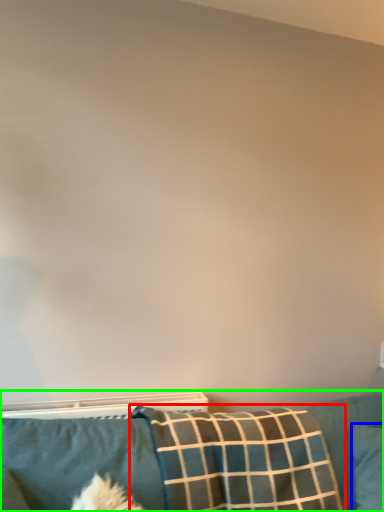
Question: Which is nearer to the pillow (highlighted by a red box)? pillow (highlighted by a blue box) or furniture (highlighted by a green box).

Choices:
 (A) pillow
 (B) furniture

Answer: (B)